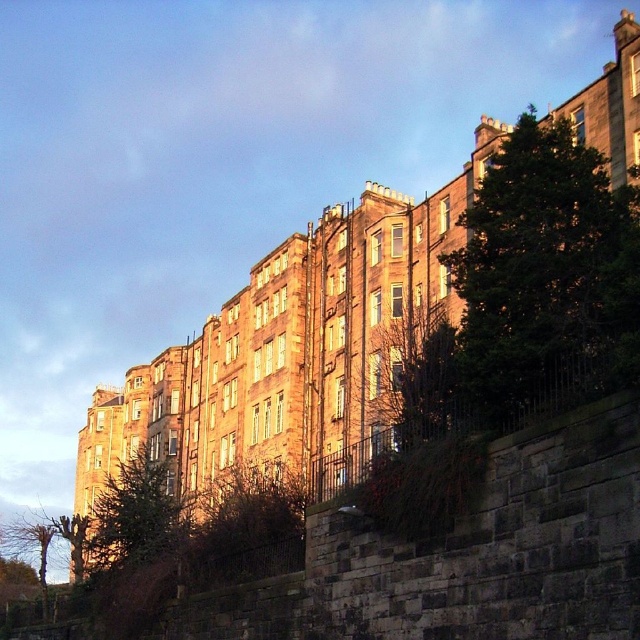
Who is positioned more to the right, dark green leafy tree at right or green textured tree at center?

dark green leafy tree at right is more to the right.

Can you confirm if dark green leafy tree at right is positioned above green textured tree at center?

Yes, dark green leafy tree at right is above green textured tree at center.

Describe the element at coordinates (547, 278) in the screenshot. The image size is (640, 640). I see `dark green leafy tree at right` at that location.

Where is `dark green leafy tree at right`? This screenshot has height=640, width=640. dark green leafy tree at right is located at coordinates (547, 278).